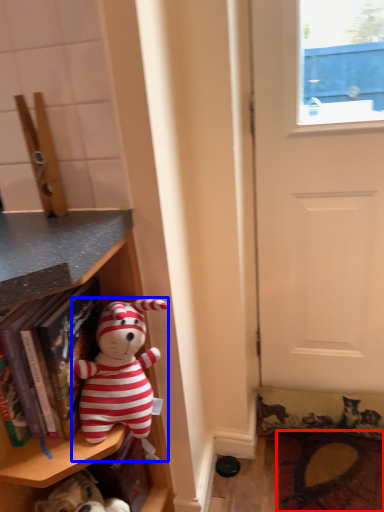
Question: Among these objects, which one is farthest to the camera, doormat (highlighted by a red box) or toy (highlighted by a blue box)?

Choices:
 (A) doormat
 (B) toy

Answer: (A)